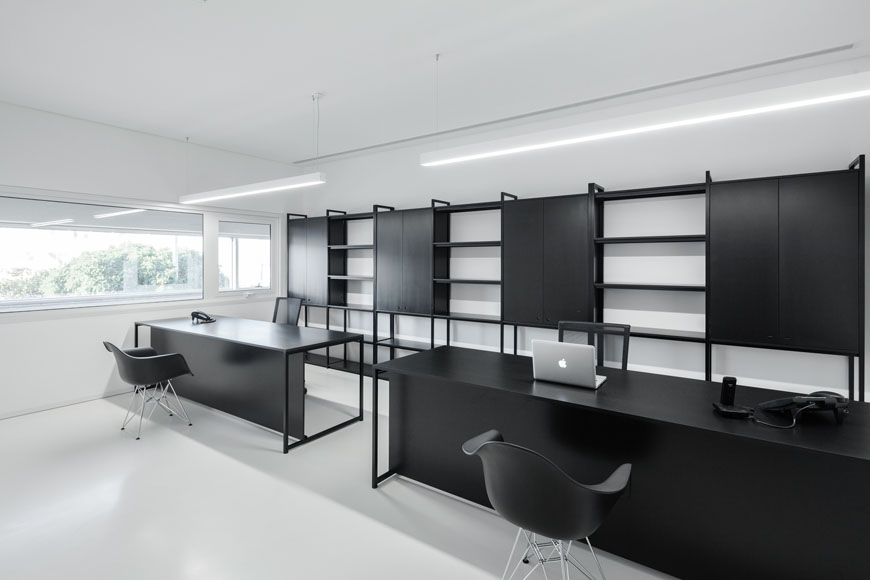
The width and height of the screenshot is (870, 580). What are the coordinates of `window` in the screenshot? It's located at (59, 288).